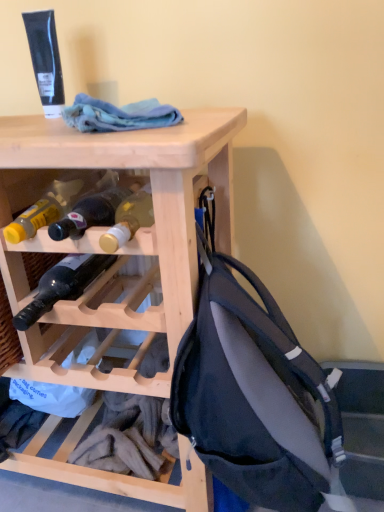
Locate an element on the screen. free location to the right of blue cotton cloth at upper center is located at coordinates (203, 115).